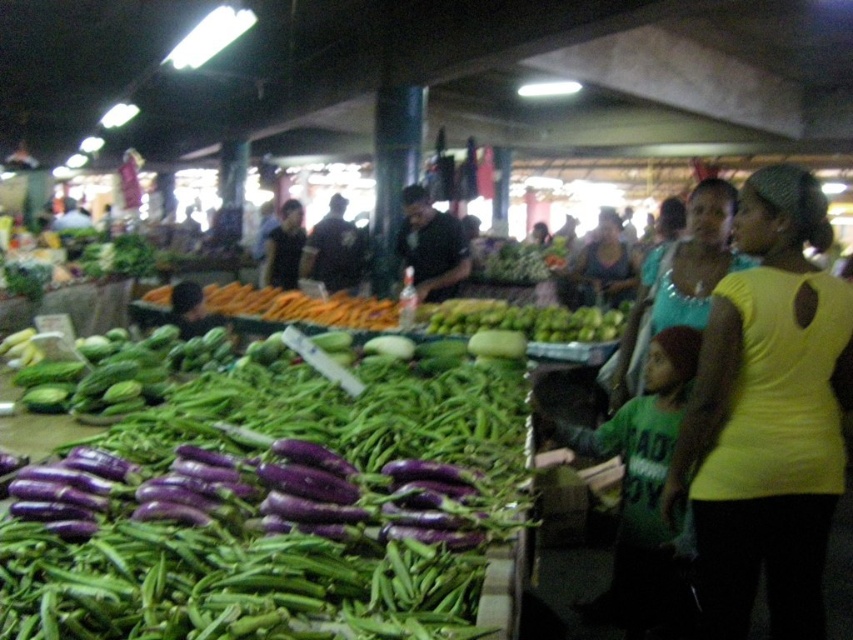
Question: Which point appears closest to the camera in this image?

Choices:
 (A) (717, 264)
 (B) (729, 499)

Answer: (B)

Question: Can you confirm if purple glossy eggplant at center is positioned to the right of yellow matte shirt at right?

Choices:
 (A) no
 (B) yes

Answer: (A)

Question: From the image, what is the correct spatial relationship of teal fabric top at center in relation to dark blue shirt at center?

Choices:
 (A) above
 (B) below

Answer: (B)

Question: Which point appears closest to the camera in this image?

Choices:
 (A) (811, 387)
 (B) (607, 227)

Answer: (A)

Question: Which point is farther to the camera?

Choices:
 (A) (693, 273)
 (B) (70, 600)
 (C) (398, 244)
 (D) (767, 408)

Answer: (C)

Question: Can you confirm if purple glossy eggplant at center is positioned above matte green shirt at center?

Choices:
 (A) yes
 (B) no

Answer: (B)